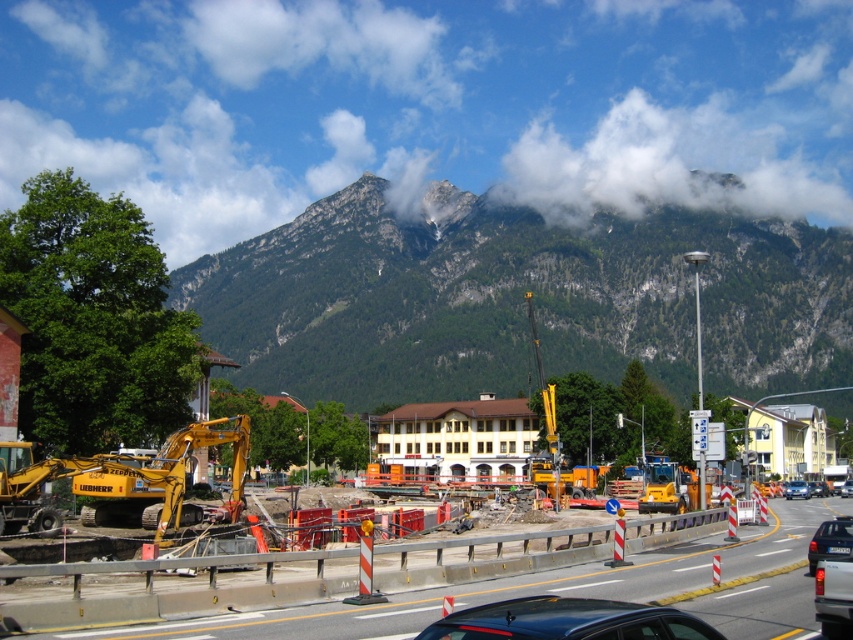
Does metallic silver sedan at center appear under black glossy car at center?

Actually, metallic silver sedan at center is above black glossy car at center.

Is metallic silver sedan at center to the right of black glossy car at center from the viewer's perspective?

In fact, metallic silver sedan at center is to the left of black glossy car at center.

What do you see at coordinates (796, 490) in the screenshot? The width and height of the screenshot is (853, 640). I see `metallic silver sedan at center` at bounding box center [796, 490].

Where is `metallic silver sedan at center`? Image resolution: width=853 pixels, height=640 pixels. metallic silver sedan at center is located at coordinates (796, 490).

How far apart are yellow metallic crane at center and matte black car at lower right?

They are 52.56 meters apart.

Does yellow metallic crane at center have a larger size compared to matte black car at lower right?

Correct, yellow metallic crane at center is larger in size than matte black car at lower right.

Does point (543, 401) lie behind point (837, 528)?

Yes, it is behind point (837, 528).

I want to click on yellow metallic crane at center, so click(x=555, y=442).

Is concrete barrier at center shorter than metallic silver sedan at center?

No, concrete barrier at center is not shorter than metallic silver sedan at center.

Can you confirm if concrete barrier at center is smaller than metallic silver sedan at center?

Incorrect, concrete barrier at center is not smaller in size than metallic silver sedan at center.

Image resolution: width=853 pixels, height=640 pixels. What do you see at coordinates (505, 586) in the screenshot?
I see `concrete barrier at center` at bounding box center [505, 586].

Find the location of `concrete barrier at center`. concrete barrier at center is located at coordinates (505, 586).